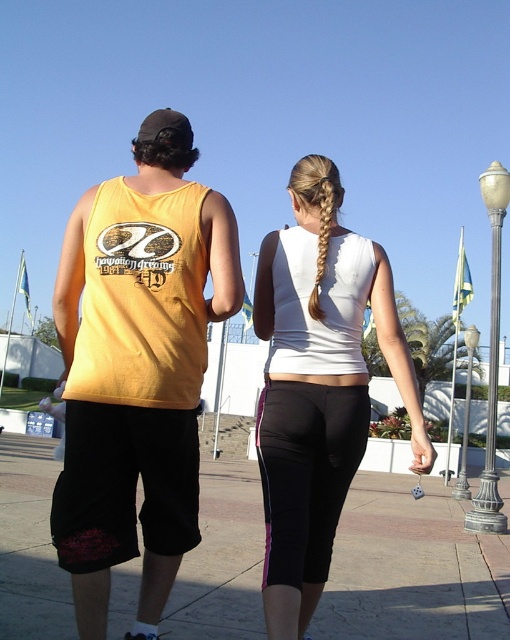
Question: Which point appears farthest from the camera in this image?

Choices:
 (A) (316, 598)
 (B) (240, 300)

Answer: (A)

Question: Where is yellow fabric tank top at left located in relation to black rubber pavement at lower center in the image?

Choices:
 (A) below
 (B) above

Answer: (B)

Question: Can you confirm if yellow cotton tank top at left is smaller than golden blonde hair at upper center?

Choices:
 (A) yes
 (B) no

Answer: (A)

Question: Which is farther from the golden blonde hair at upper center?

Choices:
 (A) yellow cotton tank top at left
 (B) white matte tank top at center

Answer: (A)

Question: Can you confirm if yellow cotton tank top at left is positioned to the right of black rubber pavement at lower center?

Choices:
 (A) no
 (B) yes

Answer: (B)

Question: Which object is positioned closest to the golden blonde hair at upper center?

Choices:
 (A) black rubber pavement at lower center
 (B) yellow fabric tank top at left
 (C) white matte tank top at center
 (D) yellow cotton tank top at left

Answer: (C)